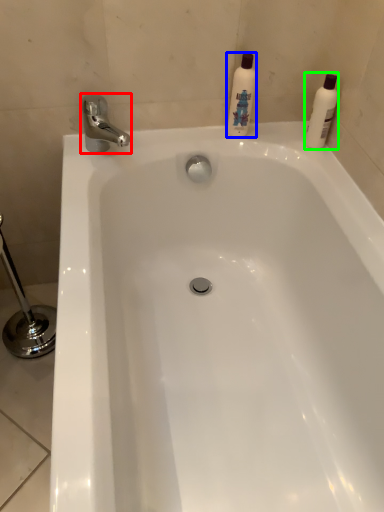
Question: Which object is the closest to the tap (highlighted by a red box)? Choose among these: cleaning product (highlighted by a blue box) or cleaning product (highlighted by a green box).

Choices:
 (A) cleaning product
 (B) cleaning product

Answer: (A)